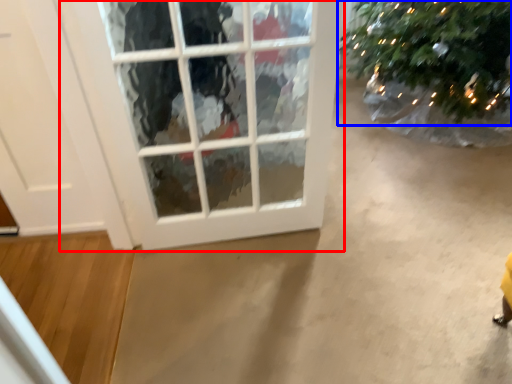
Question: Among these objects, which one is farthest to the camera, window (highlighted by a red box) or christmas tree (highlighted by a blue box)?

Choices:
 (A) window
 (B) christmas tree

Answer: (B)